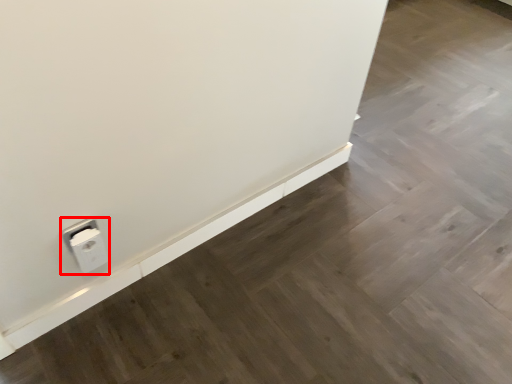
Question: Considering the relative positions of power plugs and sockets (annotated by the red box) and ledge in the image provided, where is power plugs and sockets (annotated by the red box) located with respect to the staircase?

Choices:
 (A) left
 (B) right

Answer: (A)